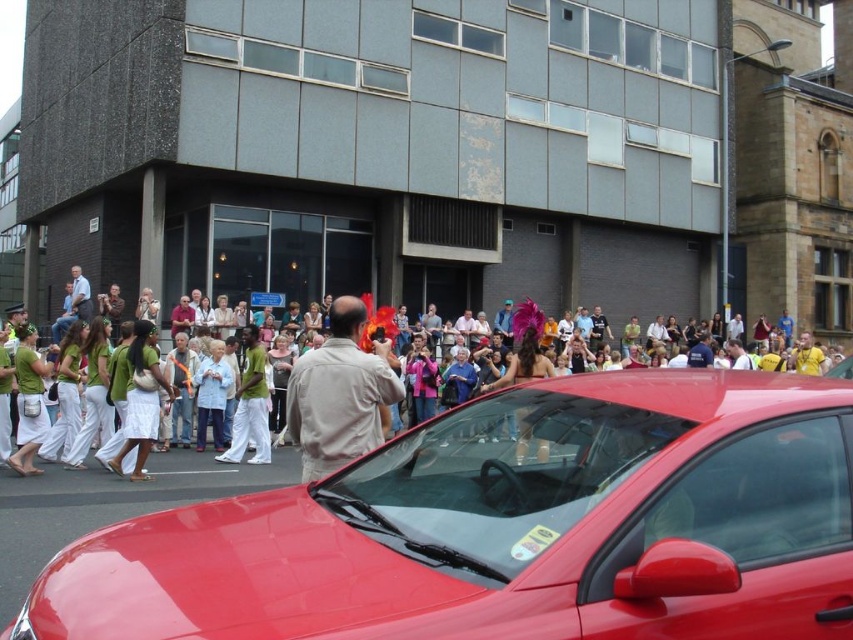
Question: Can you confirm if glossy red car at center is positioned to the left of white cotton pants at center?

Choices:
 (A) no
 (B) yes

Answer: (A)

Question: Is glossy red car at center thinner than matte khaki shirt at center?

Choices:
 (A) yes
 (B) no

Answer: (A)

Question: Is glossy red car at center thinner than white cotton pants at center?

Choices:
 (A) no
 (B) yes

Answer: (A)

Question: Which object is positioned farthest from the light brown cotton shirt at center?

Choices:
 (A) glossy red car at center
 (B) matte khaki shirt at center

Answer: (B)

Question: Which point appears closest to the camera in this image?

Choices:
 (A) (241, 412)
 (B) (614, 444)
 (C) (361, 349)
 (D) (456, 522)

Answer: (D)

Question: Which is nearer to the light brown cotton shirt at center?

Choices:
 (A) glossy red car at center
 (B) matte khaki shirt at center

Answer: (A)